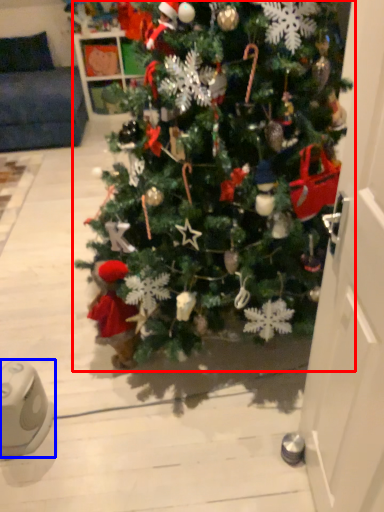
Question: Which object appears farthest to the camera in this image, christmas tree (highlighted by a red box) or ipod (highlighted by a blue box)?

Choices:
 (A) christmas tree
 (B) ipod

Answer: (B)